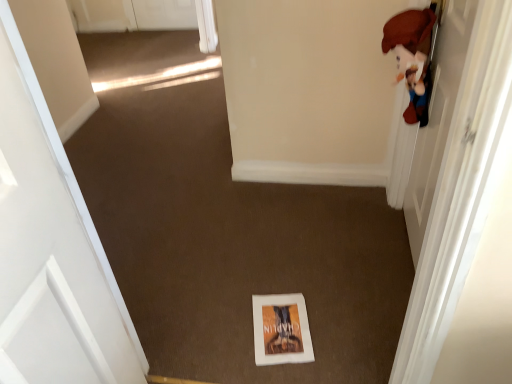
Question: Can you confirm if white matte door at left, the 1th door positioned from the left, is wider than white glossy door at upper right, positioned as the 2th door in left-to-right order?

Choices:
 (A) no
 (B) yes

Answer: (A)

Question: Does white matte door at left, the 1th door positioned from the left, have a lesser width compared to white glossy door at upper right, positioned as the 2th door in left-to-right order?

Choices:
 (A) no
 (B) yes

Answer: (B)

Question: Can you confirm if white matte door at left, positioned as the 2th door in right-to-left order, is shorter than white glossy door at upper right, which is counted as the first door, starting from the right?

Choices:
 (A) yes
 (B) no

Answer: (B)

Question: From a real-world perspective, is white matte door at left, positioned as the 2th door in right-to-left order, under white glossy door at upper right, which is counted as the first door, starting from the right?

Choices:
 (A) yes
 (B) no

Answer: (B)

Question: From the image's perspective, does white matte door at left, the 1th door positioned from the left, appear higher than white glossy door at upper right, positioned as the 2th door in left-to-right order?

Choices:
 (A) yes
 (B) no

Answer: (B)

Question: From a real-world perspective, is white matte door at left, positioned as the 2th door in right-to-left order, physically above white glossy door at upper right, which is counted as the first door, starting from the right?

Choices:
 (A) yes
 (B) no

Answer: (A)

Question: Considering the relative sizes of white paper book at center and white matte door at left, positioned as the 2th door in right-to-left order, in the image provided, is white paper book at center thinner than white matte door at left, positioned as the 2th door in right-to-left order,?

Choices:
 (A) no
 (B) yes

Answer: (A)

Question: From the image's perspective, would you say white paper book at center is shown under white matte door at left, positioned as the 2th door in right-to-left order?

Choices:
 (A) yes
 (B) no

Answer: (A)

Question: Does white paper book at center lie behind white matte door at left, positioned as the 2th door in right-to-left order?

Choices:
 (A) yes
 (B) no

Answer: (A)

Question: Does white paper book at center have a larger size compared to white matte door at left, positioned as the 2th door in right-to-left order?

Choices:
 (A) yes
 (B) no

Answer: (B)

Question: Is white paper book at center not inside white matte door at left, positioned as the 2th door in right-to-left order?

Choices:
 (A) yes
 (B) no

Answer: (A)

Question: Could you tell me if white paper book at center is turned towards white matte door at left, the 1th door positioned from the left?

Choices:
 (A) no
 (B) yes

Answer: (A)

Question: Is white matte door at left, the 1th door positioned from the left, closer to the viewer compared to white paper book at center?

Choices:
 (A) no
 (B) yes

Answer: (B)